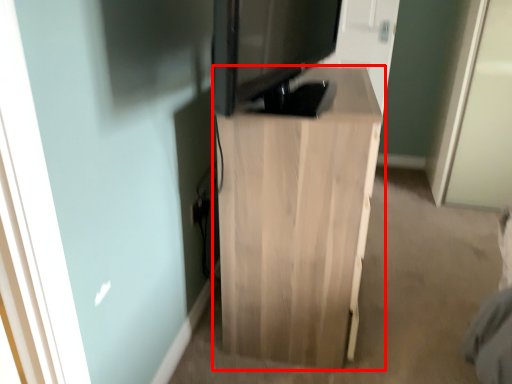
Question: From the image's perspective, what is the correct spatial positioning of furniture (annotated by the red box) in reference to electronic?

Choices:
 (A) below
 (B) above

Answer: (A)